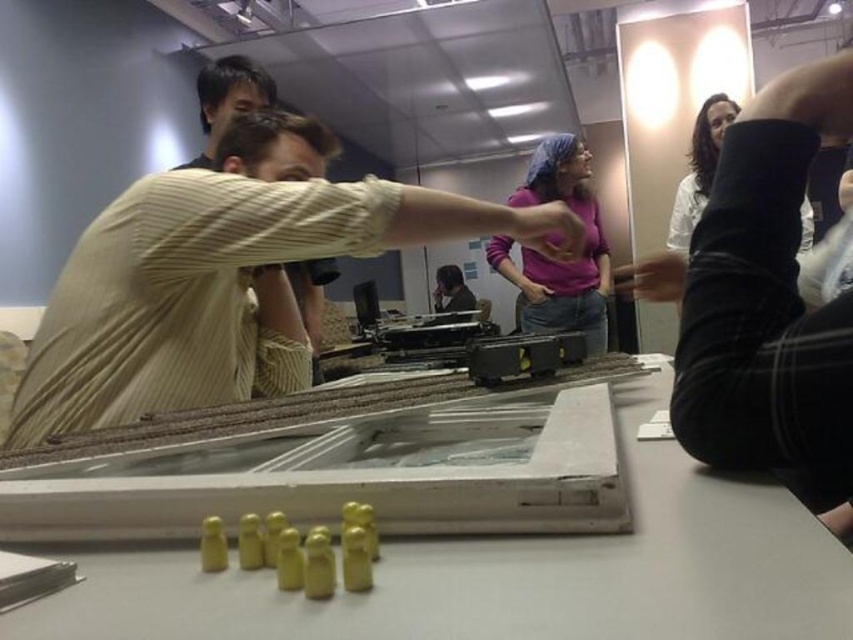
You are a person standing in the room and looking at the white matte table at center and the matte black shirt at center. Which object is closer to the floor?

The white matte table at center is closer to the floor because it is below the matte black shirt at center.

You are a person standing in the room. You see the white matte table at center and the purple matte shirt at center. Which object is closer to the floor?

The white matte table at center is closer to the floor because it is below the purple matte shirt at center.

You are standing in the room and want to place a 1.5 meter long object on the white matte table at center. Based on its coordinates, can you determine if the table is large enough to accommodate the object?

The white matte table at center is positioned at coordinates point (514, 573), but without specific dimensions provided for the table itself, it is impossible to determine if it can fit a 1.5 meter long object. Additional information about the table size is required.